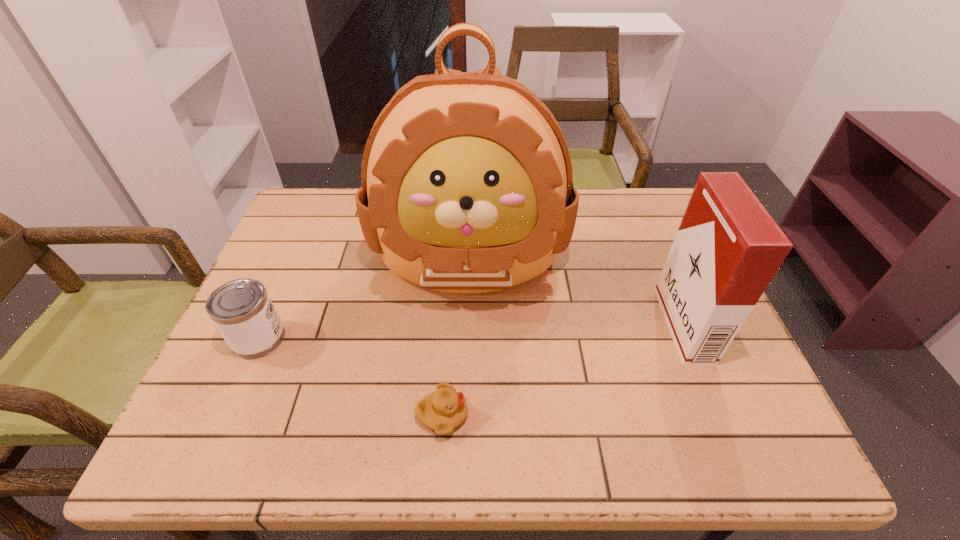
Locate an element on the screen. vacant space at the far left corner of the desktop is located at coordinates (342, 201).

What are the coordinates of `free spot between the tallest object and the nearest object` in the screenshot? It's located at (456, 337).

Where is `vacant space in between the backpack and the third tallest object`? The width and height of the screenshot is (960, 540). vacant space in between the backpack and the third tallest object is located at coordinates pos(364,298).

What are the coordinates of `free space between the tallest object and the shortest object` in the screenshot? It's located at (456, 337).

Where is `empty space between the rightmost object and the tallest object`? The image size is (960, 540). empty space between the rightmost object and the tallest object is located at coordinates (576, 292).

Find the location of a particular element. Image resolution: width=960 pixels, height=540 pixels. free space between the shortest object and the can is located at coordinates (350, 377).

Locate an element on the screen. The image size is (960, 540). free spot between the tallest object and the leftmost object is located at coordinates (364, 298).

The height and width of the screenshot is (540, 960). I want to click on free area in between the third shortest object and the shortest object, so click(x=563, y=370).

Find the location of `vacant area that lies between the cigarette_case and the nearest object`. vacant area that lies between the cigarette_case and the nearest object is located at coordinates (563, 370).

Locate an element on the screen. This screenshot has width=960, height=540. vacant region between the backpack and the nearest object is located at coordinates (456, 337).